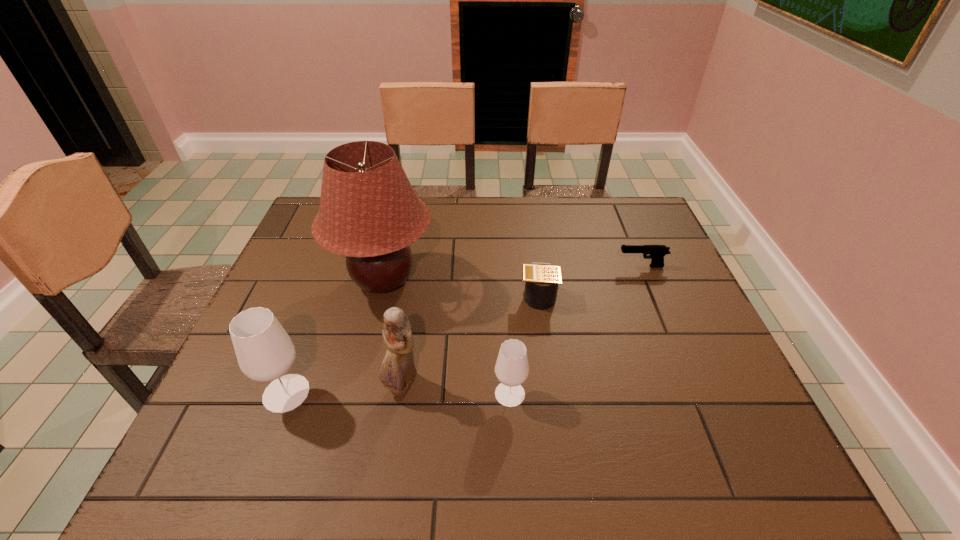
This screenshot has width=960, height=540. What are the coordinates of `blank space at the far edge of the desktop` in the screenshot? It's located at click(x=431, y=207).

This screenshot has height=540, width=960. Identify the location of free spot at the near edge of the desktop. (588, 396).

Image resolution: width=960 pixels, height=540 pixels. I want to click on vacant space at the left edge of the desktop, so click(306, 252).

At what (x,y) coordinates should I click in order to perform the action: click on free region at the right edge of the desktop. Please return your answer as a coordinate pair (x, y). Looking at the image, I should click on (672, 383).

Find the location of a particular element. blank area at the far left corner is located at coordinates (312, 212).

At what (x,y) coordinates should I click in order to perform the action: click on unoccupied area between the calculator and the tallest object. Please return your answer as a coordinate pair (x, y). The width and height of the screenshot is (960, 540). Looking at the image, I should click on (461, 287).

This screenshot has width=960, height=540. Identify the location of vacant space that's between the calculator and the lampshade. (461, 287).

The width and height of the screenshot is (960, 540). Identify the location of free point between the rightmost object and the calculator. (590, 281).

Identify the location of free spot between the shortest object and the taller glass. (464, 330).

At what (x,y) coordinates should I click in order to perform the action: click on free space that is in between the fourth object from left to right and the shortest object. Please return your answer as a coordinate pair (x, y). Looking at the image, I should click on (576, 330).